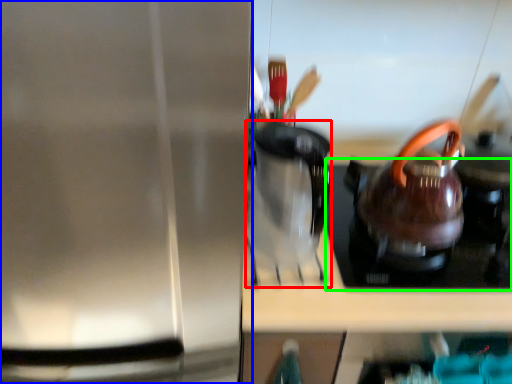
Question: Which is nearer to the coffeepot (highlighted by a red box)? kitchen appliance (highlighted by a blue box) or gas stove (highlighted by a green box).

Choices:
 (A) kitchen appliance
 (B) gas stove

Answer: (B)